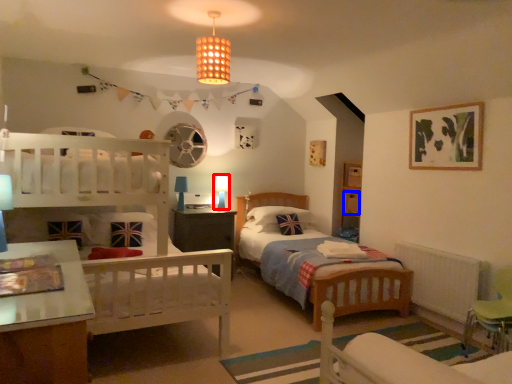
Question: Which object appears farthest to the camera in this image, table lamp (highlighted by a red box) or drawer (highlighted by a blue box)?

Choices:
 (A) table lamp
 (B) drawer

Answer: (A)